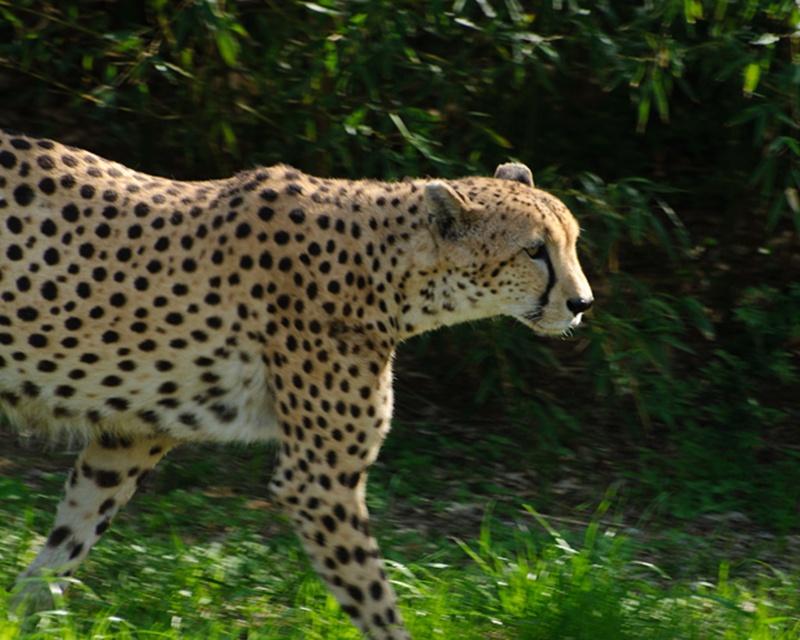
Is point (36, 157) positioned behind point (276, 544)?

No, (36, 157) is closer to viewer.

Is spotted fur cheetah at center to the left of green grass at lower center from the viewer's perspective?

Yes, spotted fur cheetah at center is to the left of green grass at lower center.

Image resolution: width=800 pixels, height=640 pixels. I want to click on spotted fur cheetah at center, so click(x=250, y=324).

Find the location of a particular element. The height and width of the screenshot is (640, 800). spotted fur cheetah at center is located at coordinates (250, 324).